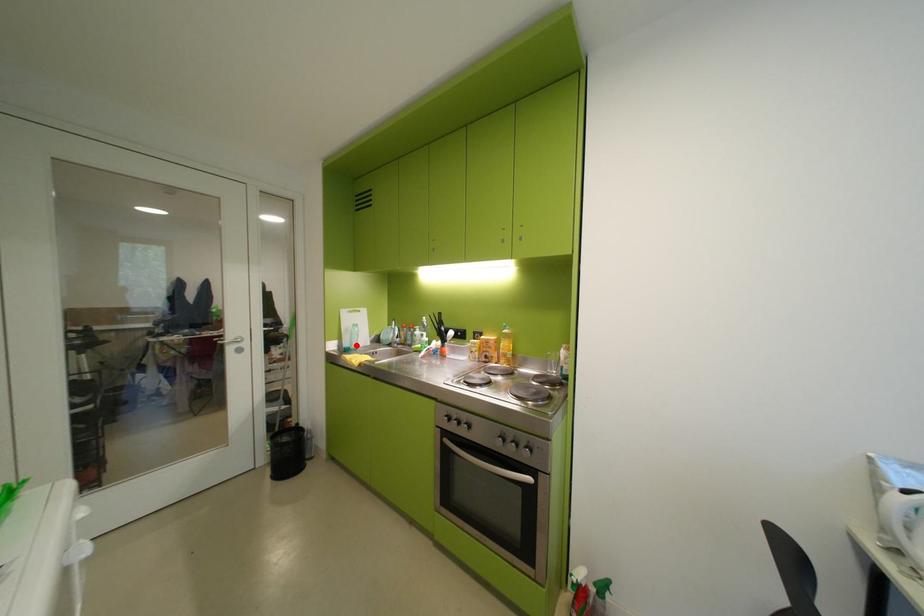
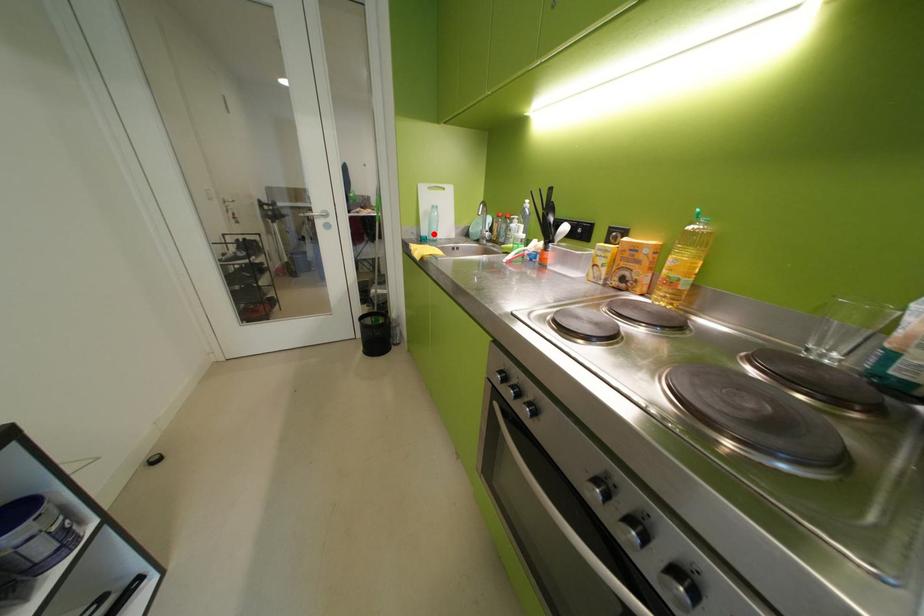
I am providing you with two images of the same scene from different viewpoints. A red point is marked on the first image and another point is marked on the second image. Do the highlighted points in image1 and image2 indicate the same real-world spot?

Yes